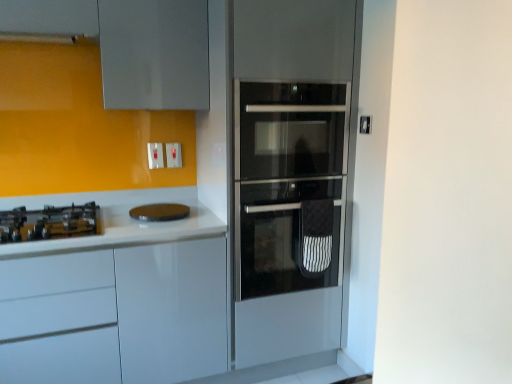
Question: Considering the positions of point click(x=157, y=150) and point click(x=183, y=266), is point click(x=157, y=150) closer or farther from the camera than point click(x=183, y=266)?

Choices:
 (A) closer
 (B) farther

Answer: (B)

Question: In terms of width, does white plastic switch at upper center, which is counted as the 1th electric outlet, starting from the left, look wider or thinner when compared to white glossy cabinet at left?

Choices:
 (A) thin
 (B) wide

Answer: (A)

Question: Which is farther from the white glossy cabinet at left?

Choices:
 (A) yellow matte gas stove at left
 (B) brown matte cutting board at center
 (C) white plastic switch at upper center, which is counted as the 1th electric outlet, starting from the left
 (D) white plastic switch at upper center, the second electric outlet when ordered from left to right
 (E) stainless steel oven at center

Answer: (D)

Question: Which of these objects is positioned farthest from the yellow matte gas stove at left?

Choices:
 (A) stainless steel oven at center
 (B) brown matte cutting board at center
 (C) white glossy cabinet at left
 (D) white plastic switch at upper center, which is counted as the 1th electric outlet, starting from the left
 (E) white plastic switch at upper center, placed as the first electric outlet when sorted from right to left

Answer: (A)